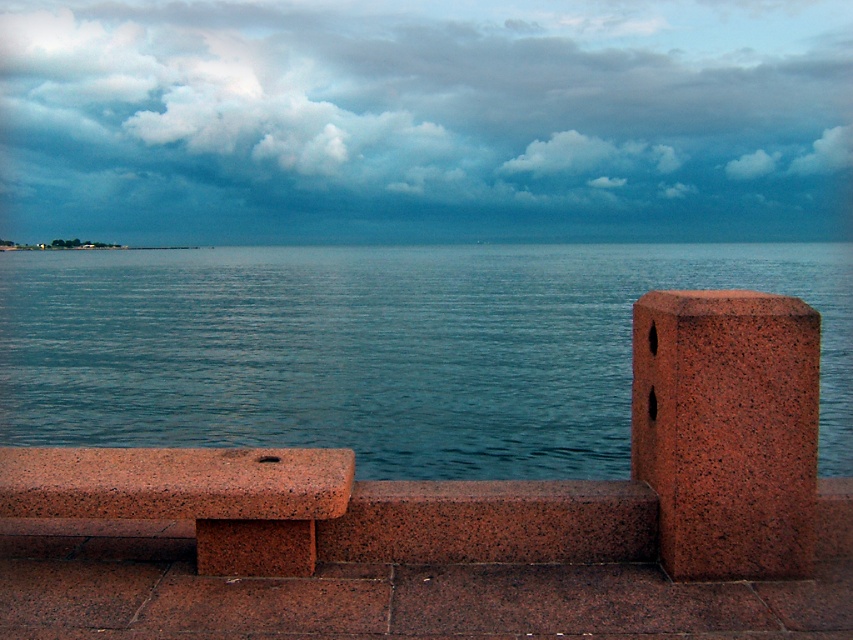
Question: Which object is closer to the camera taking this photo?

Choices:
 (A) granite bench at left
 (B) cloudy sky at upper center

Answer: (A)

Question: Based on their relative distances, which object is nearer to the granite bench at left?

Choices:
 (A) blue water at center
 (B) cloudy sky at upper center
 (C) granite at right

Answer: (C)

Question: Estimate the real-world distances between objects in this image. Which object is closer to the granite at right?

Choices:
 (A) granite bench at left
 (B) cloudy sky at upper center

Answer: (A)

Question: Is the position of blue water at center less distant than that of granite at right?

Choices:
 (A) yes
 (B) no

Answer: (A)

Question: In this image, where is cloudy sky at upper center located relative to granite at right?

Choices:
 (A) right
 (B) left

Answer: (B)

Question: Does cloudy sky at upper center have a smaller size compared to granite bench at left?

Choices:
 (A) yes
 (B) no

Answer: (B)